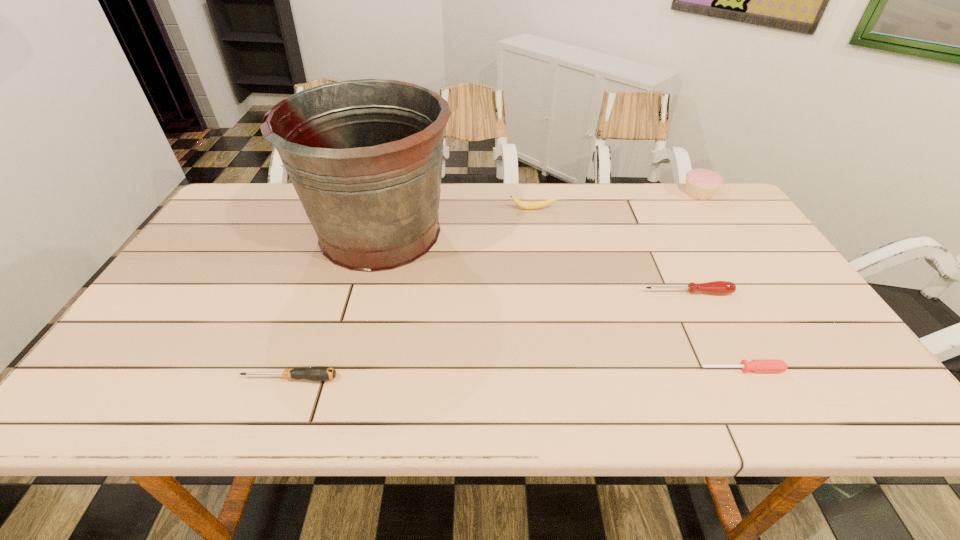
Where is `empty space between the shortest screwdriver and the tallest object`? Image resolution: width=960 pixels, height=540 pixels. empty space between the shortest screwdriver and the tallest object is located at coordinates (562, 301).

You are a GUI agent. You are given a task and a screenshot of the screen. Output one action in this format:
    pyautogui.click(x=<x>, y=<y>)
    Task: Click on the vacant space that's between the leftmost screwdriver and the third object from left to right
    The width and height of the screenshot is (960, 540).
    Given the screenshot: What is the action you would take?
    pyautogui.click(x=411, y=294)

Find the location of `free spot between the farthest screwdriver and the fourth object from right to left`. free spot between the farthest screwdriver and the fourth object from right to left is located at coordinates click(611, 251).

This screenshot has width=960, height=540. What are the coordinates of `vacant space that is in between the fifth shortest object and the tallest object` in the screenshot? It's located at (540, 213).

Where is `vacant space that is in between the cupcake and the farthest screwdriver`? vacant space that is in between the cupcake and the farthest screwdriver is located at coordinates (693, 243).

Find the location of `object that can be found as the second closest to the farthest screwdriver`. object that can be found as the second closest to the farthest screwdriver is located at coordinates (522, 204).

Identify which object is the fourth closest to the shortest screwdriver. Please provide its 2D coordinates. Your answer should be formatted as a tuple, i.e. [(x, y)], where the tuple contains the x and y coordinates of a point satisfying the conditions above.

[(522, 204)]

Locate an element on the screen. The width and height of the screenshot is (960, 540). screwdriver object that ranks as the second closest to the shortest screwdriver is located at coordinates (317, 373).

Where is `screwdriver that stands as the second closest to the bucket`? The width and height of the screenshot is (960, 540). screwdriver that stands as the second closest to the bucket is located at coordinates (716, 287).

Where is `vacant space that satisfies the following two spatial constraints: 1. on the front side of the tallest object; 2. on the left side of the shortest screwdriver`? Image resolution: width=960 pixels, height=540 pixels. vacant space that satisfies the following two spatial constraints: 1. on the front side of the tallest object; 2. on the left side of the shortest screwdriver is located at coordinates (343, 369).